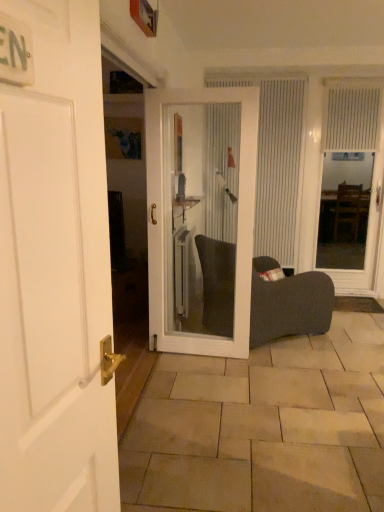
Question: From a real-world perspective, is dark fabric chair at center physically located above or below white matte door at left, the second door positioned from the back?

Choices:
 (A) above
 (B) below

Answer: (B)

Question: In the image, is dark fabric chair at center positioned in front of or behind white matte door at left, the second door positioned from the back?

Choices:
 (A) front
 (B) behind

Answer: (B)

Question: Which object is positioned closest to the beige stone tile at lower center?

Choices:
 (A) transparent glass door at right
 (B) white glossy door at center, the 1th door positioned from the back
 (C) white textured curtain at upper right, the 1th curtain viewed from the right
 (D) white vertical blinds at center, which appears as the first curtain when viewed from the left
 (E) dark fabric chair at center

Answer: (E)

Question: Which object is the farthest from the dark fabric chair at center?

Choices:
 (A) transparent glass door at right
 (B) white textured curtain at upper right, the 1th curtain viewed from the right
 (C) white glossy door at center, which appears as the second door when viewed from the front
 (D) beige stone tile at lower center
 (E) white matte door at left, the second door positioned from the back

Answer: (E)